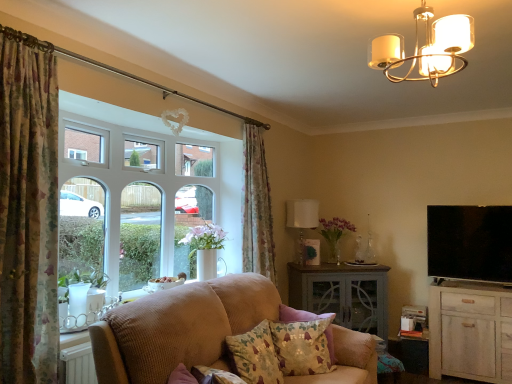
Locate an element on the screen. floral fabric curtain at upper left, the first curtain viewed from the back is located at coordinates (257, 206).

From the picture: In order to face white wood cabinet at lower right, should I rotate leftwards or rightwards?

You should look right and rotate roughly 26.875 degrees.

At what (x,y) coordinates should I click in order to perform the action: click on beige fabric couch at lower center. Please return your answer as a coordinate pair (x, y). This screenshot has height=384, width=512. Looking at the image, I should click on (180, 328).

Can you see white fabric lampshade at center, placed as the second lamp when sorted from front to back, touching floral fabric curtain at upper left, positioned as the second curtain in left-to-right order?

No, white fabric lampshade at center, placed as the second lamp when sorted from front to back, is not in contact with floral fabric curtain at upper left, positioned as the second curtain in left-to-right order.

From the white fabric lampshade at center, arranged as the first lamp when viewed from the back, count 1st curtains forward and point to it. Please provide its 2D coordinates.

[(257, 206)]

Is white fabric lampshade at center, placed as the second lamp when sorted from front to back, at the left side of floral fabric curtain at upper left, the first curtain viewed from the back?

No, white fabric lampshade at center, placed as the second lamp when sorted from front to back, is not to the left of floral fabric curtain at upper left, the first curtain viewed from the back.

Based on their sizes in the image, would you say beige fabric couch at lower center is bigger or smaller than white wood cabinet at lower right?

Considering their sizes, beige fabric couch at lower center takes up more space than white wood cabinet at lower right.

What are the coordinates of `studio couch in front of the white wood cabinet at lower right` in the screenshot? It's located at (180, 328).

Is beige fabric couch at lower center inside the boundaries of white wood cabinet at lower right, or outside?

beige fabric couch at lower center is not enclosed by white wood cabinet at lower right.

Between beige fabric couch at lower center and white wood cabinet at lower right, which one is positioned in front?

beige fabric couch at lower center is more forward.

Is white wood cabinet at lower right shorter than gray painted cabinet at center, the 1th table when ordered from left to right?

Yes.

Is white wood cabinet at lower right situated inside gray painted cabinet at center, the 1th table when ordered from left to right, or outside?

white wood cabinet at lower right cannot be found inside gray painted cabinet at center, the 1th table when ordered from left to right.

From a real-world perspective, does white wood cabinet at lower right sit lower than gray painted cabinet at center, the 1th table when ordered from left to right?

Indeed, from a real-world perspective, white wood cabinet at lower right is positioned beneath gray painted cabinet at center, the 1th table when ordered from left to right.

How different are the orientations of white wood cabinet at lower right and gray painted cabinet at center, the second table in the right-to-left sequence, in degrees?

white wood cabinet at lower right and gray painted cabinet at center, the second table in the right-to-left sequence, are facing 41.2 degrees away from each other.

Considering the relative sizes of floral fabric cushion at lower center, the second pillow from the front, and floral fabric curtain at upper left, which is counted as the 2th curtain, starting from the front, in the image provided, is floral fabric cushion at lower center, the second pillow from the front, wider than floral fabric curtain at upper left, which is counted as the 2th curtain, starting from the front,?

Incorrect, the width of floral fabric cushion at lower center, the second pillow from the front, does not surpass that of floral fabric curtain at upper left, which is counted as the 2th curtain, starting from the front.

Looking at this image, can you tell me how much floral fabric cushion at lower center, the first pillow positioned from the back, and floral fabric curtain at upper left, the first curtain in the right-to-left sequence, differ in facing direction?

64.5 degrees separate the facing orientations of floral fabric cushion at lower center, the first pillow positioned from the back, and floral fabric curtain at upper left, the first curtain in the right-to-left sequence.

From the image's perspective, count 2nd pillows downward from the floral fabric curtain at upper left, the first curtain viewed from the back, and point to it. Please provide its 2D coordinates.

[(303, 346)]

Can you confirm if floral fabric cushion at lower center, the first pillow positioned from the back, is positioned to the right of floral fabric curtain at upper left, the first curtain in the right-to-left sequence?

Yes, floral fabric cushion at lower center, the first pillow positioned from the back, is to the right of floral fabric curtain at upper left, the first curtain in the right-to-left sequence.

From the image's perspective, is white glass window at left located above flat screen tv at right?

Yes, from the image's perspective, white glass window at left is above flat screen tv at right.

Considering the positions of point (183, 191) and point (495, 271), is point (183, 191) closer or farther from the camera than point (495, 271)?

Point (183, 191) is closer to the camera than point (495, 271).

From a real-world perspective, is white glass window at left under flat screen tv at right?

Incorrect, from a real-world perspective, white glass window at left is higher than flat screen tv at right.

Looking at this image, which object is thinner, white glass window at left or flat screen tv at right?

With smaller width is flat screen tv at right.

In the scene shown: Is white glass window at left bigger than gray painted cabinet at center, the 1th table when ordered from left to right?

Yes.

Is gray painted cabinet at center, the 1th table when ordered from left to right, at the back of white glass window at left?

No, white glass window at left's orientation is not away from gray painted cabinet at center, the 1th table when ordered from left to right.

From the image's perspective, is white glass window at left positioned above or below gray painted cabinet at center, the 1th table when ordered from left to right?

white glass window at left is situated higher than gray painted cabinet at center, the 1th table when ordered from left to right, in the image.

Is gray painted cabinet at center, the 1th table when ordered from left to right, facing away from flat screen tv at right?

No, gray painted cabinet at center, the 1th table when ordered from left to right,'s orientation is not away from flat screen tv at right.

Considering the positions of point (307, 307) and point (459, 267), is point (307, 307) closer or farther from the camera than point (459, 267)?

Point (307, 307) appears to be farther away from the viewer than point (459, 267).

From the picture: Is gray painted cabinet at center, the 1th table when ordered from left to right, at the left side of flat screen tv at right?

Correct, you'll find gray painted cabinet at center, the 1th table when ordered from left to right, to the left of flat screen tv at right.

From the image's perspective, who appears lower, gray painted cabinet at center, the 1th table when ordered from left to right, or flat screen tv at right?

gray painted cabinet at center, the 1th table when ordered from left to right.

Where is `lamp that appears behind the floral fabric curtain at upper left, positioned as the second curtain in left-to-right order`? The image size is (512, 384). lamp that appears behind the floral fabric curtain at upper left, positioned as the second curtain in left-to-right order is located at coordinates (302, 214).

In order to click on studio couch in front of the white wood cabinet at lower right in this screenshot , I will do `click(180, 328)`.

From the image, which object appears to be nearer to beige fabric couch at lower center, floral fabric curtain at upper left, which is counted as the 2th curtain, starting from the front, or floral fabric cushion at lower center, the second pillow from the front?

The object closer to beige fabric couch at lower center is floral fabric cushion at lower center, the second pillow from the front.

Looking at the image, which one is located closer to metallic chandelier at upper center, the second lamp from the bottom, gray painted cabinet at center, the second table in the right-to-left sequence, or floral fabric cushion at lower center, the first pillow positioned from the back?

Based on the image, floral fabric cushion at lower center, the first pillow positioned from the back, appears to be nearer to metallic chandelier at upper center, the second lamp from the bottom.

Estimate the real-world distances between objects in this image. Which object is further from beige fabric couch at lower center, wooden side table at lower right, marked as the first table in a right-to-left arrangement, or floral fabric curtain at left, the 1th curtain positioned from the front?

Based on the image, wooden side table at lower right, marked as the first table in a right-to-left arrangement, appears to be further to beige fabric couch at lower center.

Estimate the real-world distances between objects in this image. Which object is closer to wooden side table at lower right, marked as the first table in a right-to-left arrangement, white fabric lampshade at center, the 2th lamp in the top-to-bottom sequence, or flat screen tv at right?

Among the two, flat screen tv at right is located nearer to wooden side table at lower right, marked as the first table in a right-to-left arrangement.

Estimate the real-world distances between objects in this image. Which object is further from metallic chandelier at upper center, the first lamp in the top-to-bottom sequence, white wood cabinet at lower right or floral fabric cushion at lower center, the second pillow from the front?

white wood cabinet at lower right.

Looking at the image, which one is located further to flat screen tv at right, white fabric lampshade at center, arranged as the first lamp when viewed from the back, or gray painted cabinet at center, the second table in the right-to-left sequence?

white fabric lampshade at center, arranged as the first lamp when viewed from the back, lies further to flat screen tv at right than the other object.

Estimate the real-world distances between objects in this image. Which object is further from metallic chandelier at upper center, which is the 1th lamp in front-to-back order, white glass window at left or floral fabric curtain at upper left, the first curtain in the right-to-left sequence?

white glass window at left lies further to metallic chandelier at upper center, which is the 1th lamp in front-to-back order, than the other object.

Estimate the real-world distances between objects in this image. Which object is further from wooden side table at lower right, the second table from the left, beige fabric couch at lower center or floral fabric pillow at center, acting as the second pillow starting from the back?

The object further to wooden side table at lower right, the second table from the left, is beige fabric couch at lower center.

The width and height of the screenshot is (512, 384). I want to click on window between floral fabric curtain at left, the 2th curtain viewed from the back, and metallic chandelier at upper center, which appears as the second lamp when viewed from the back, so click(x=136, y=201).

Find the location of a particular element. Image resolution: width=512 pixels, height=384 pixels. window between floral fabric curtain at left, the 1th curtain positioned from the front, and flat screen tv at right from left to right is located at coordinates (136, 201).

In order to click on pillow between floral fabric curtain at upper left, positioned as the second curtain in left-to-right order, and flat screen tv at right in this screenshot , I will do `click(303, 346)`.

Locate an element on the screen. The height and width of the screenshot is (384, 512). table positioned between floral fabric cushion at lower center, the first pillow positioned from the back, and gray painted cabinet at center, the second table in the right-to-left sequence, from near to far is located at coordinates (x=411, y=352).